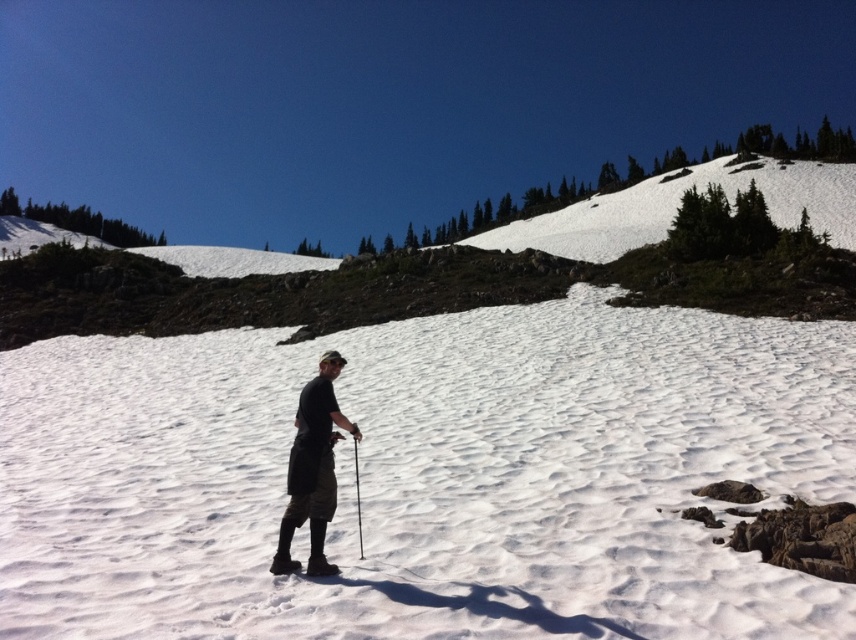
Question: Which of the following is the farthest from the observer?

Choices:
 (A) (107, 486)
 (B) (311, 390)
 (C) (360, 525)

Answer: (A)

Question: Which point is farther to the camera?

Choices:
 (A) (331, 440)
 (B) (385, 602)

Answer: (A)

Question: Which point is closer to the camera taking this photo?

Choices:
 (A) (354, 456)
 (B) (324, 358)
 (C) (280, 456)

Answer: (B)

Question: Does dark gray fabric shorts at center come in front of metallic silver ski pole at center?

Choices:
 (A) yes
 (B) no

Answer: (A)

Question: Can you confirm if white fluffy snow at center is positioned above dark gray fabric shorts at center?

Choices:
 (A) yes
 (B) no

Answer: (A)

Question: Is white fluffy snow at center bigger than metallic silver ski pole at center?

Choices:
 (A) yes
 (B) no

Answer: (A)